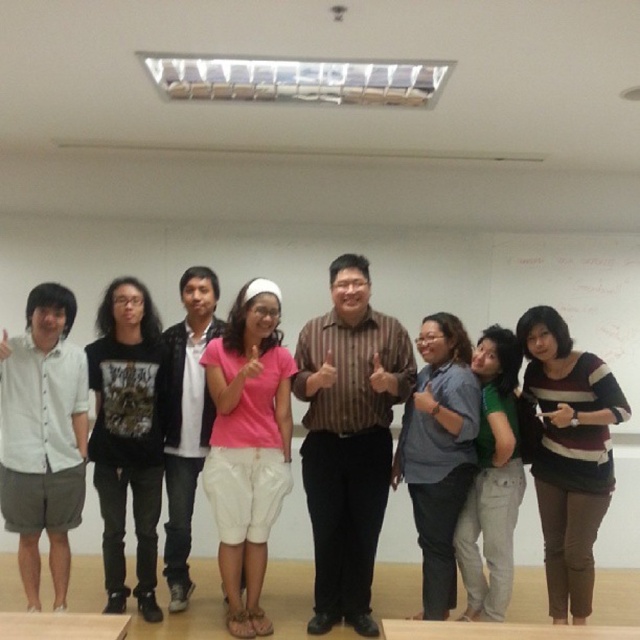
Question: Considering the real-world distances, which object is closest to the striped sweater at center?

Choices:
 (A) green cotton shirt at center
 (B) whiteboard at center
 (C) brown striped shirt at center

Answer: (A)

Question: Which of these objects is positioned closest to the light gray cotton shorts at left?

Choices:
 (A) brown striped shirt at center
 (B) green cotton shirt at center

Answer: (A)

Question: Does black cotton t-shirt at left appear on the right side of green cotton shirt at center?

Choices:
 (A) no
 (B) yes

Answer: (A)

Question: Can you confirm if light gray cotton shorts at left is positioned to the left of green cotton shirt at center?

Choices:
 (A) yes
 (B) no

Answer: (A)

Question: Considering the real-world distances, which object is farthest from the black cotton t-shirt at left?

Choices:
 (A) brown striped shirt at center
 (B) striped sweater at center
 (C) whiteboard at center
 (D) pink matte t-shirt at center

Answer: (C)

Question: Observing the image, what is the correct spatial positioning of blue shirt at center in reference to white cotton shirt at center?

Choices:
 (A) right
 (B) left

Answer: (A)